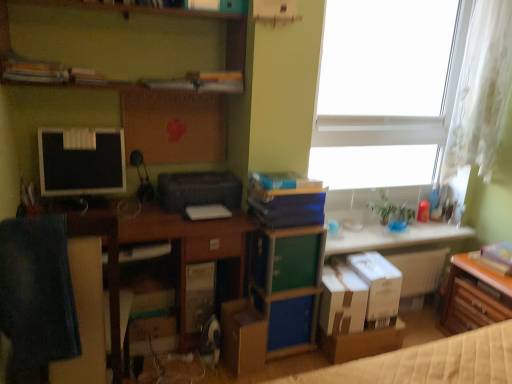
Find the location of a particular element. The height and width of the screenshot is (384, 512). free spot below matte black monitor at left (from a real-world perspective) is located at coordinates (83, 204).